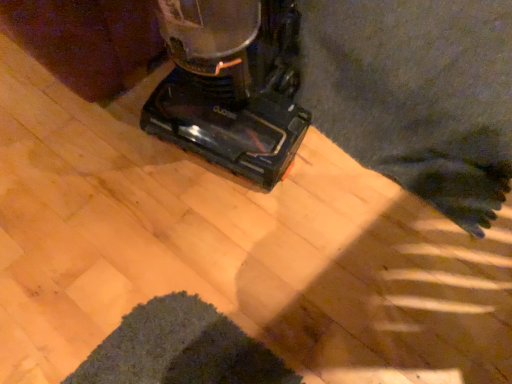
The width and height of the screenshot is (512, 384). I want to click on black plastic vacuum cleaner at center, so click(x=231, y=85).

Describe the element at coordinates (231, 85) in the screenshot. The width and height of the screenshot is (512, 384). I see `black plastic vacuum cleaner at center` at that location.

Locate an element on the screen. black plastic vacuum cleaner at center is located at coordinates (231, 85).